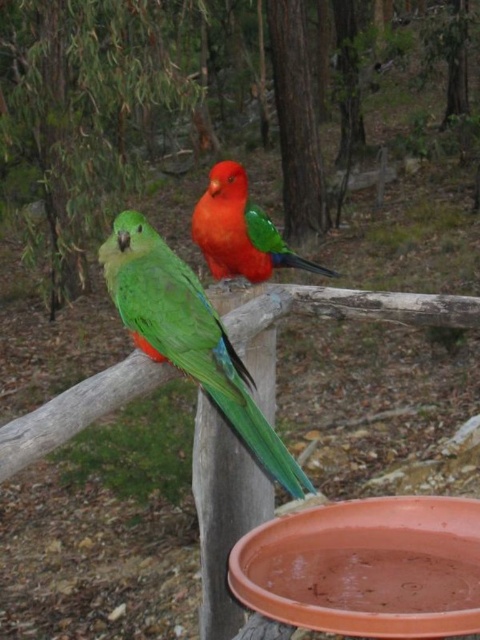
Does green glossy parrot at left appear on the left side of shiny orange parrot at center?

Correct, you'll find green glossy parrot at left to the left of shiny orange parrot at center.

Does green glossy parrot at left have a larger size compared to shiny orange parrot at center?

Yes, green glossy parrot at left is bigger than shiny orange parrot at center.

Who is more forward, (168, 298) or (210, 266)?

Point (168, 298) is in front.

Where is `green glossy parrot at left`? The height and width of the screenshot is (640, 480). green glossy parrot at left is located at coordinates (189, 337).